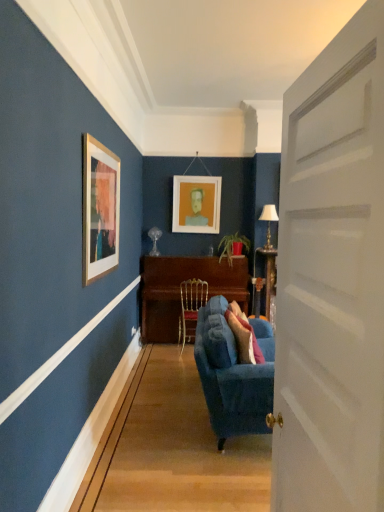
Question: Is velvet blue couch at center oriented towards white matte picture frame at center?

Choices:
 (A) no
 (B) yes

Answer: (A)

Question: From the image's perspective, is velvet blue couch at center above white matte picture frame at center?

Choices:
 (A) no
 (B) yes

Answer: (A)

Question: Does velvet blue couch at center have a greater width compared to white matte picture frame at center?

Choices:
 (A) no
 (B) yes

Answer: (B)

Question: Is velvet blue couch at center not inside white matte picture frame at center?

Choices:
 (A) no
 (B) yes

Answer: (B)

Question: Is velvet blue couch at center positioned behind white matte picture frame at center?

Choices:
 (A) no
 (B) yes

Answer: (A)

Question: Is velvet blue couch at center bigger than white matte picture frame at center?

Choices:
 (A) no
 (B) yes

Answer: (B)

Question: From the image's perspective, is white matte picture frame at center located above velvet blue couch at center?

Choices:
 (A) no
 (B) yes

Answer: (B)

Question: From a real-world perspective, is white matte picture frame at center over velvet blue couch at center?

Choices:
 (A) no
 (B) yes

Answer: (B)

Question: Is white matte picture frame at center to the right of velvet blue couch at center from the viewer's perspective?

Choices:
 (A) no
 (B) yes

Answer: (A)

Question: Is velvet blue couch at center completely or partially inside white matte picture frame at center?

Choices:
 (A) no
 (B) yes

Answer: (A)

Question: Does white matte picture frame at center turn towards velvet blue couch at center?

Choices:
 (A) yes
 (B) no

Answer: (A)

Question: Can you confirm if white matte picture frame at center is smaller than velvet blue couch at center?

Choices:
 (A) yes
 (B) no

Answer: (A)

Question: Does white fabric lampshade at right have a greater width compared to white matte picture frame at center?

Choices:
 (A) yes
 (B) no

Answer: (A)